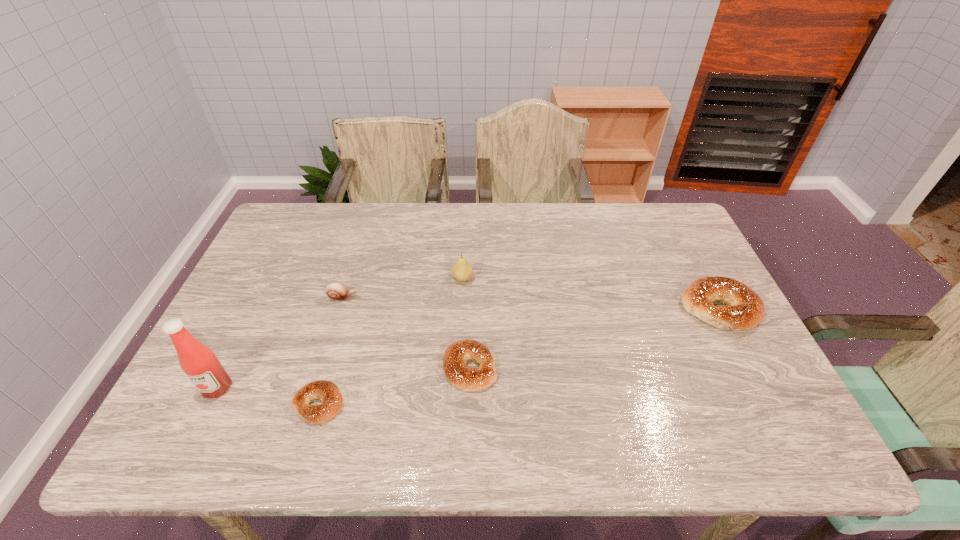
I want to click on vacant area that lies between the fifth tallest object and the fifth shortest object, so click(x=466, y=323).

At what (x,y) coordinates should I click in order to perform the action: click on the third closest object relative to the leftmost object. Please return your answer as a coordinate pair (x, y). This screenshot has height=540, width=960. Looking at the image, I should click on click(457, 372).

Choose which object is the nearest neighbor to the rightmost bagel. Please provide its 2D coordinates. Your answer should be formatted as a tuple, i.e. [(x, y)], where the tuple contains the x and y coordinates of a point satisfying the conditions above.

[(457, 372)]

Choose which bagel is the nearest neighbor to the rightmost bagel. Please provide its 2D coordinates. Your answer should be formatted as a tuple, i.e. [(x, y)], where the tuple contains the x and y coordinates of a point satisfying the conditions above.

[(457, 372)]

What are the coordinates of `bagel object that ranks as the closest to the leftmost bagel` in the screenshot? It's located at (457, 372).

Where is `free location that satisfies the following two spatial constraints: 1. on the front-facing side of the shortest bagel; 2. on the left side of the tallest object`? The width and height of the screenshot is (960, 540). free location that satisfies the following two spatial constraints: 1. on the front-facing side of the shortest bagel; 2. on the left side of the tallest object is located at coordinates (209, 404).

Locate an element on the screen. free space that satisfies the following two spatial constraints: 1. on the front-facing side of the escargot; 2. on the right side of the second tallest bagel is located at coordinates (322, 368).

At what (x,y) coordinates should I click in order to perform the action: click on vacant space that satisfies the following two spatial constraints: 1. on the front-facing side of the escargot; 2. on the front-facing side of the tallest object. Please return your answer as a coordinate pair (x, y). This screenshot has width=960, height=540. Looking at the image, I should click on (316, 388).

Image resolution: width=960 pixels, height=540 pixels. Identify the location of free space that satisfies the following two spatial constraints: 1. on the front side of the pear; 2. on the left side of the second bagel from left to right. (459, 368).